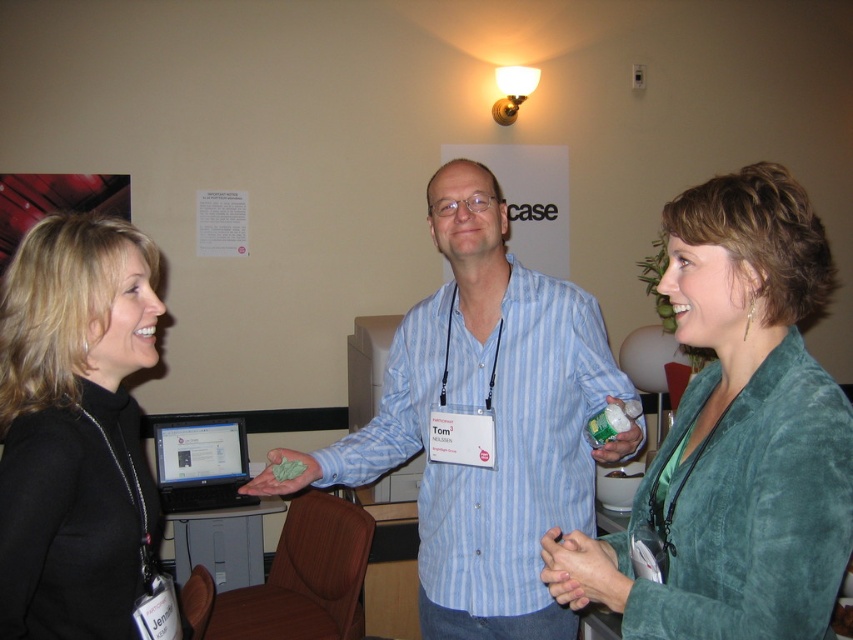
From the picture: You are standing at the point with coordinates point (x=302, y=483) and want to walk to the point (x=733, y=256). Which direction should you move in?

You should move forward because point (x=733, y=256) is in front of point (x=302, y=483).

You are a photographer in the room and want to capture a photo that includes both the blue striped shirt at center and the green matte cloth at center. Based on their positions, which object should you focus on first to ensure both are in frame?

The blue striped shirt at center is above the green matte cloth at center, so focusing on the blue striped shirt at center first will ensure the green matte cloth at center is also captured in the frame below it.